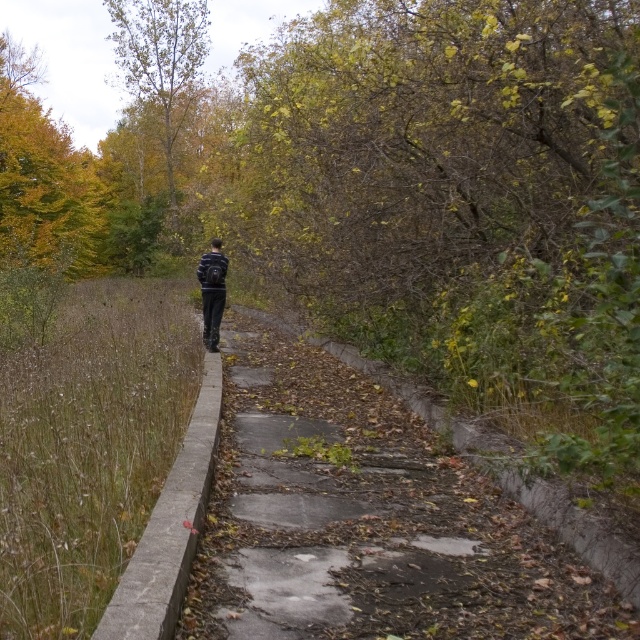
You are standing on the concrete at center and want to take a photo of the green leafy tree at upper left. Which direction should you turn to face the tree?

You should turn to your left to face the green leafy tree at upper left because the concrete at center is to the right of the tree.

You are a hiker trying to decide which clothing item to wear for the hike. You have the striped sweater at center and the dark blue fabric jacket at center. Which one offers more coverage based on their sizes?

The striped sweater at center is bigger than the dark blue fabric jacket at center, so it offers more coverage.